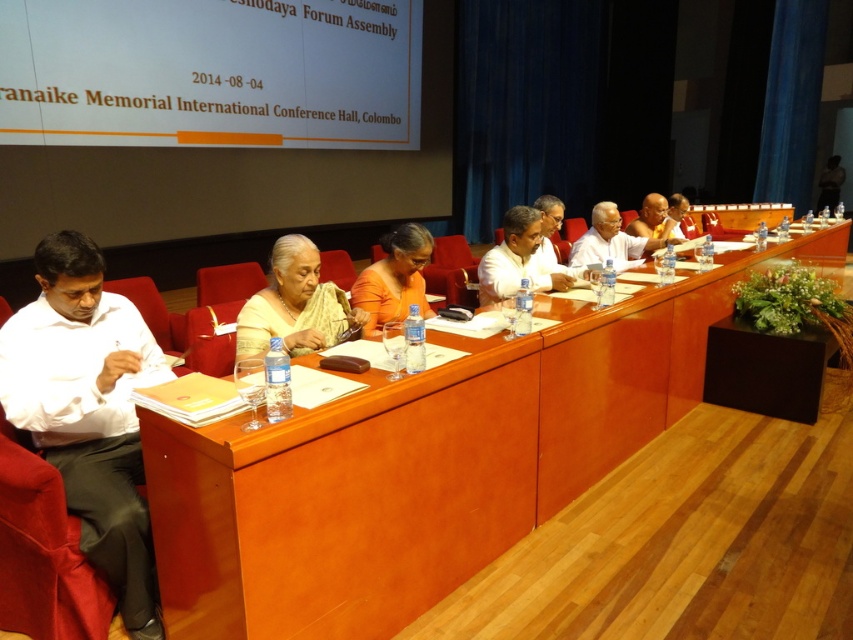
From the picture: Who is shorter, white cotton shirt at left or white glossy shirt at center?

white glossy shirt at center is shorter.

Which is in front, point (146, 358) or point (590, 212)?

Point (146, 358) is more forward.

Identify the location of white cotton shirt at left. The width and height of the screenshot is (853, 640). (88, 412).

Who is shorter, orange fabric saree at center or black fabric person at upper right?

With less height is orange fabric saree at center.

Is the position of orange fabric saree at center less distant than that of black fabric person at upper right?

Yes, it is.

Measure the distance between orange fabric saree at center and camera.

2.53 meters

Locate an element on the screen. orange fabric saree at center is located at coordinates (393, 276).

Between point (276, 259) and point (618, 257), which one is positioned in front?

Point (276, 259)

Is satin yellow saree at center taller than white glossy shirt at center?

In fact, satin yellow saree at center may be shorter than white glossy shirt at center.

Who is more distant from viewer, [300,244] or [613,221]?

Point [613,221]

Locate an element on the screen. satin yellow saree at center is located at coordinates pyautogui.click(x=294, y=305).